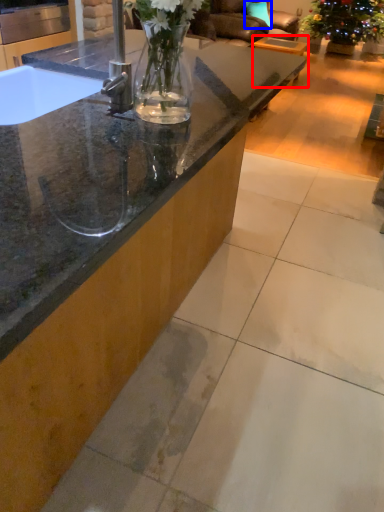
Question: Among these objects, which one is farthest to the camera, table (highlighted by a red box) or pillow (highlighted by a blue box)?

Choices:
 (A) table
 (B) pillow

Answer: (B)